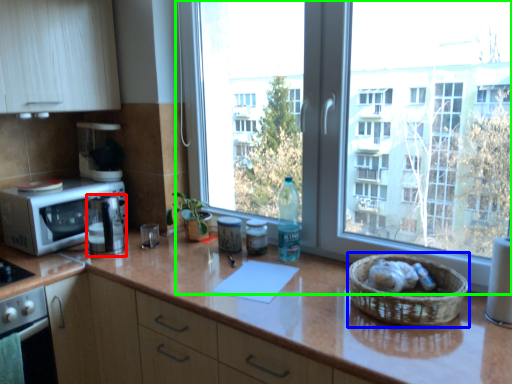
Question: Based on their relative distances, which object is farther from coffee machine (highlighted by a red box)? Choose from basket (highlighted by a blue box) and window (highlighted by a green box).

Choices:
 (A) basket
 (B) window

Answer: (A)